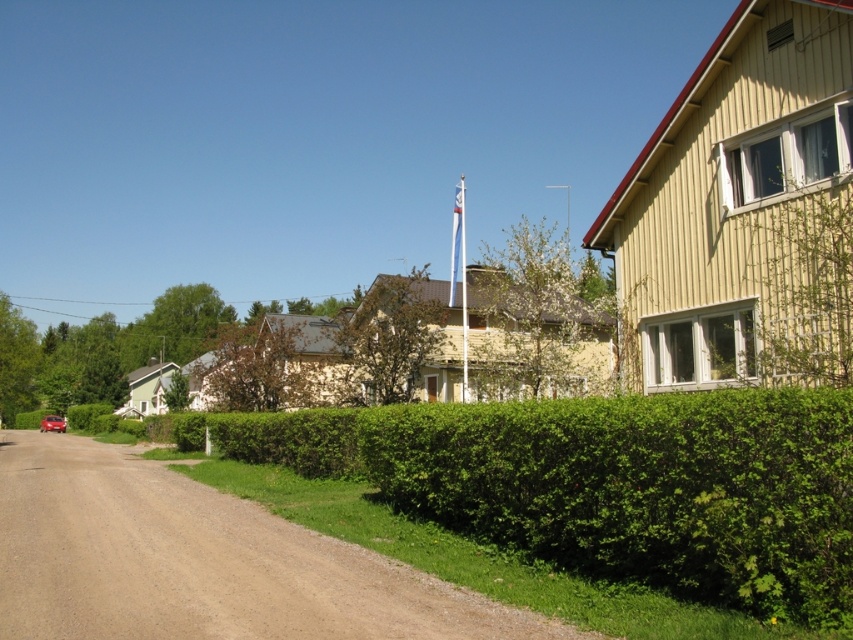
Question: Does white fabric flag at center have a larger size compared to shiny red car at lower left?

Choices:
 (A) yes
 (B) no

Answer: (A)

Question: Which of the following is the closest to the observer?

Choices:
 (A) (490, 531)
 (B) (459, 214)
 (C) (554, 625)
 (D) (50, 417)

Answer: (C)

Question: Among these points, which one is farthest from the camera?

Choices:
 (A) pos(802,545)
 (B) pos(91,508)
 (C) pos(39,424)
 (D) pos(457,188)

Answer: (D)

Question: Is the position of white fabric flag at center less distant than that of shiny red car at lower left?

Choices:
 (A) no
 (B) yes

Answer: (B)

Question: Among these objects, which one is nearest to the camera?

Choices:
 (A) green leafy hedge at center
 (B) brown gravel road at lower left

Answer: (A)

Question: Can you confirm if brown gravel road at lower left is wider than shiny red car at lower left?

Choices:
 (A) yes
 (B) no

Answer: (A)